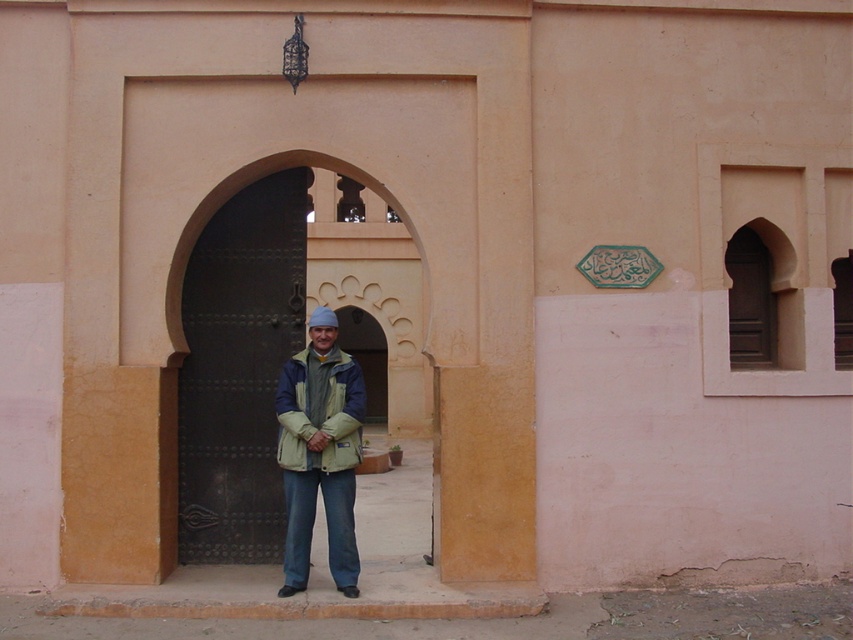
Question: Can you confirm if light green fabric jacket at center is positioned to the right of beige textured jacket at center?

Choices:
 (A) no
 (B) yes

Answer: (A)

Question: Among these objects, which one is farthest from the camera?

Choices:
 (A) dark brown metal door at center
 (B) light green fabric jacket at center

Answer: (A)

Question: Is dark brown metal door at center further to the viewer compared to light green fabric jacket at center?

Choices:
 (A) no
 (B) yes

Answer: (B)

Question: Among these points, which one is farthest from the camera?

Choices:
 (A) (305, 394)
 (B) (230, 330)
 (C) (349, 561)

Answer: (B)

Question: Among these objects, which one is farthest from the camera?

Choices:
 (A) beige textured jacket at center
 (B) dark brown metal door at center

Answer: (B)

Question: Does light green fabric jacket at center appear on the left side of beige textured jacket at center?

Choices:
 (A) no
 (B) yes

Answer: (B)